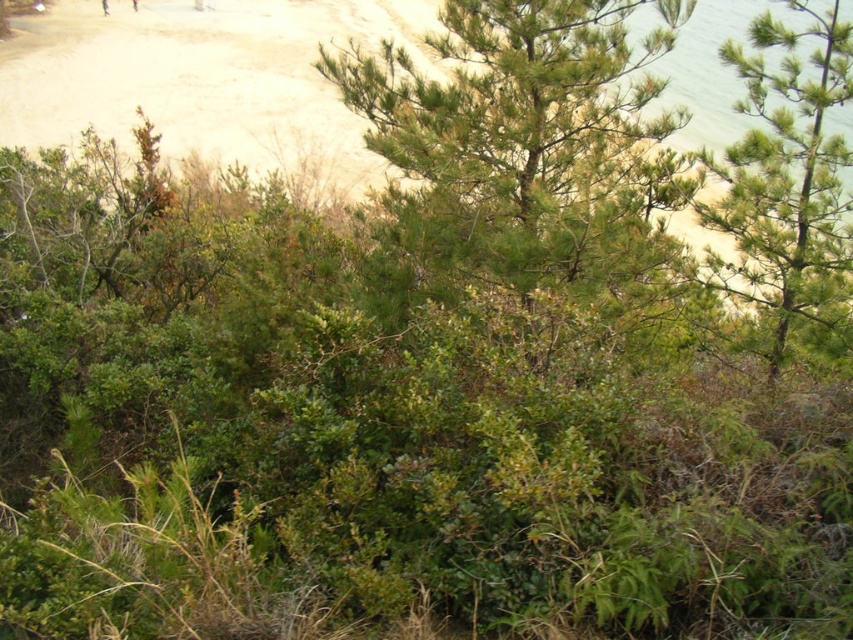
Question: Among these points, which one is farthest from the camera?

Choices:
 (A) (367, 67)
 (B) (776, 348)

Answer: (A)

Question: Which point is closer to the camera taking this photo?

Choices:
 (A) (418, 225)
 (B) (727, 205)

Answer: (A)

Question: Observing the image, what is the correct spatial positioning of green needle-like at center in reference to green needle-like at upper right?

Choices:
 (A) left
 (B) right

Answer: (A)

Question: Is green needle-like at center below green needle-like at upper right?

Choices:
 (A) no
 (B) yes

Answer: (B)

Question: Can you confirm if green needle-like at center is smaller than green needle-like at upper right?

Choices:
 (A) no
 (B) yes

Answer: (A)